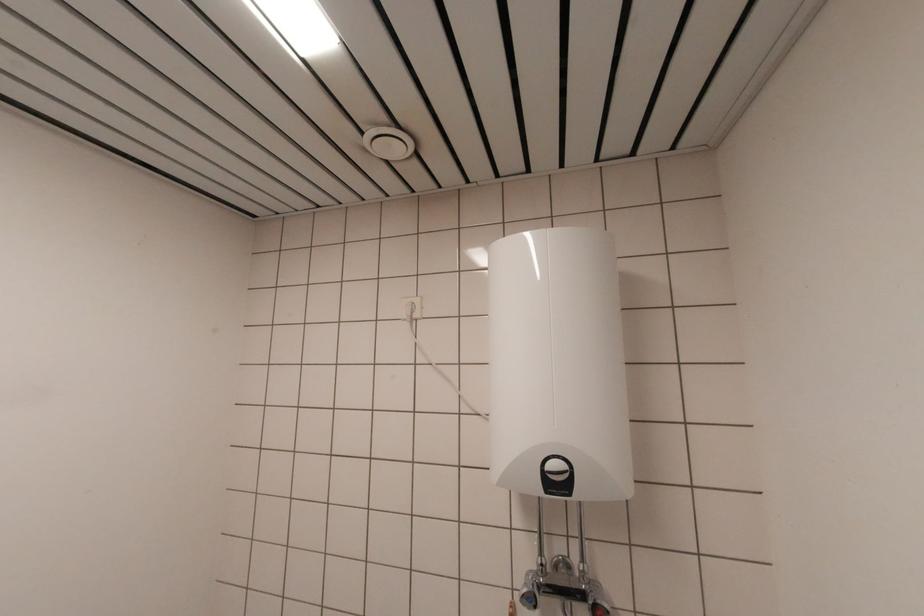
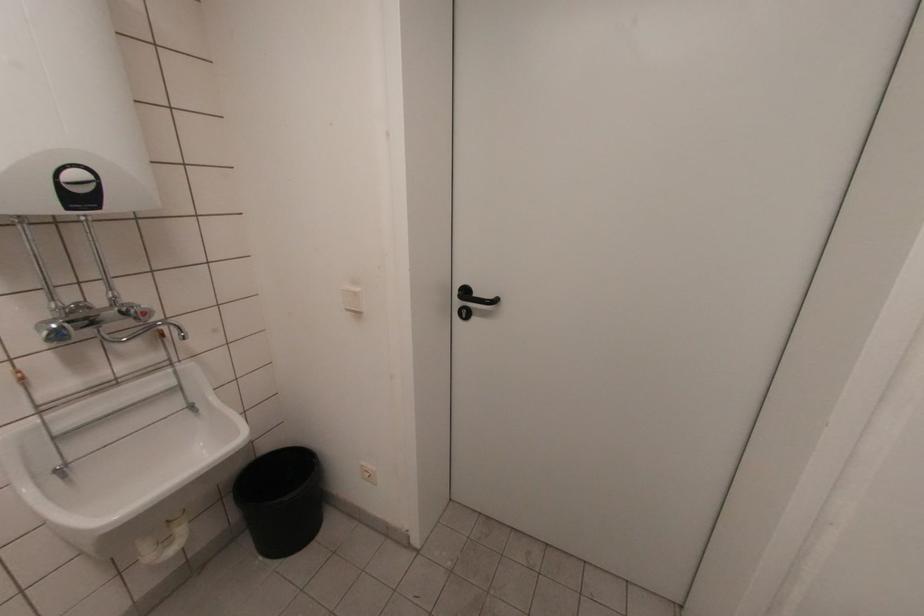
The first image is from the beginning of the video and the second image is from the end. How did the camera likely rotate when shooting the video?

The camera's rotation is toward right-down.